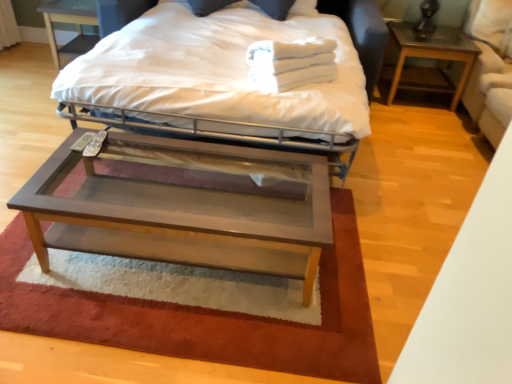
Question: Is dark wood nightstand at upper left, which ranks as the 1th nightstand in left-to-right order, not near white cotton towels at upper center?

Choices:
 (A) yes
 (B) no

Answer: (A)

Question: Can you confirm if dark wood nightstand at upper left, which ranks as the 1th nightstand in left-to-right order, is bigger than white cotton towels at upper center?

Choices:
 (A) yes
 (B) no

Answer: (A)

Question: Is dark wood nightstand at upper left, which is counted as the 2th nightstand, starting from the right, next to white cotton towels at upper center?

Choices:
 (A) no
 (B) yes

Answer: (A)

Question: Can you confirm if dark wood nightstand at upper left, which is counted as the 2th nightstand, starting from the right, is thinner than white cotton towels at upper center?

Choices:
 (A) yes
 (B) no

Answer: (B)

Question: From a real-world perspective, does dark wood nightstand at upper left, which ranks as the 1th nightstand in left-to-right order, stand above white cotton towels at upper center?

Choices:
 (A) yes
 (B) no

Answer: (B)

Question: Considering the positions of point (392, 31) and point (274, 54), is point (392, 31) closer or farther from the camera than point (274, 54)?

Choices:
 (A) farther
 (B) closer

Answer: (A)

Question: From the image's perspective, relative to white cotton towels at upper center, is brown wood nightstand at right, the first nightstand from the right, above or below?

Choices:
 (A) above
 (B) below

Answer: (A)

Question: Based on their positions, is brown wood nightstand at right, which is the second nightstand from left to right, located to the left or right of white cotton towels at upper center?

Choices:
 (A) right
 (B) left

Answer: (A)

Question: In the image, is brown wood nightstand at right, which is the second nightstand from left to right, positioned in front of or behind white cotton towels at upper center?

Choices:
 (A) front
 (B) behind

Answer: (B)

Question: Based on their sizes in the image, would you say matte white bed at center is bigger or smaller than dark wood nightstand at upper left, which ranks as the 1th nightstand in left-to-right order?

Choices:
 (A) small
 (B) big

Answer: (B)

Question: Does point (276, 33) appear closer or farther from the camera than point (74, 51)?

Choices:
 (A) farther
 (B) closer

Answer: (B)

Question: Considering the positions of matte white bed at center and dark wood nightstand at upper left, which ranks as the 1th nightstand in left-to-right order, in the image, is matte white bed at center taller or shorter than dark wood nightstand at upper left, which ranks as the 1th nightstand in left-to-right order,?

Choices:
 (A) tall
 (B) short

Answer: (A)

Question: Visually, is matte white bed at center positioned to the left or to the right of dark wood nightstand at upper left, which ranks as the 1th nightstand in left-to-right order?

Choices:
 (A) right
 (B) left

Answer: (A)

Question: Based on their sizes in the image, would you say white cotton towels at upper center is bigger or smaller than white fabric swivel chair at right?

Choices:
 (A) small
 (B) big

Answer: (A)

Question: Based on their positions, is white cotton towels at upper center located to the left or right of white fabric swivel chair at right?

Choices:
 (A) right
 (B) left

Answer: (B)